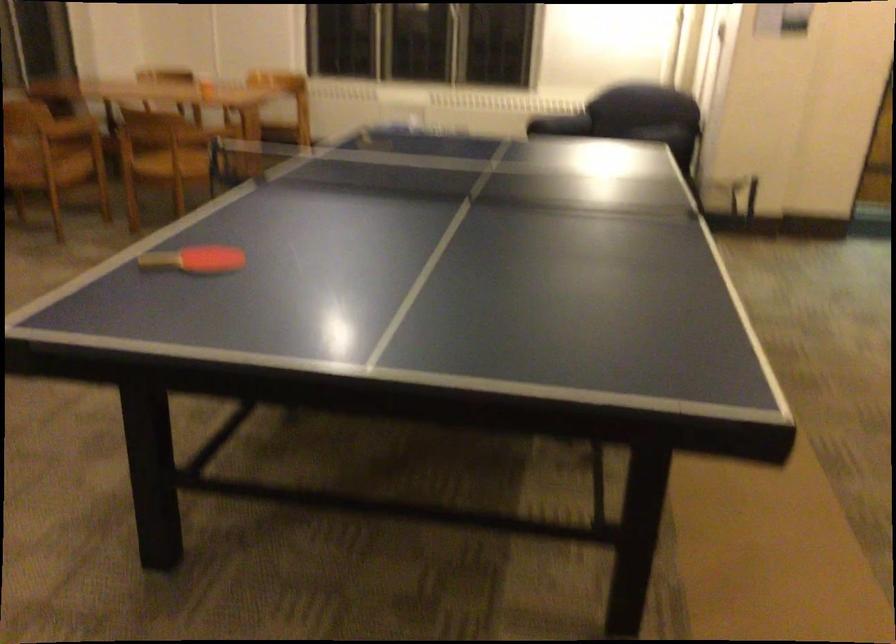
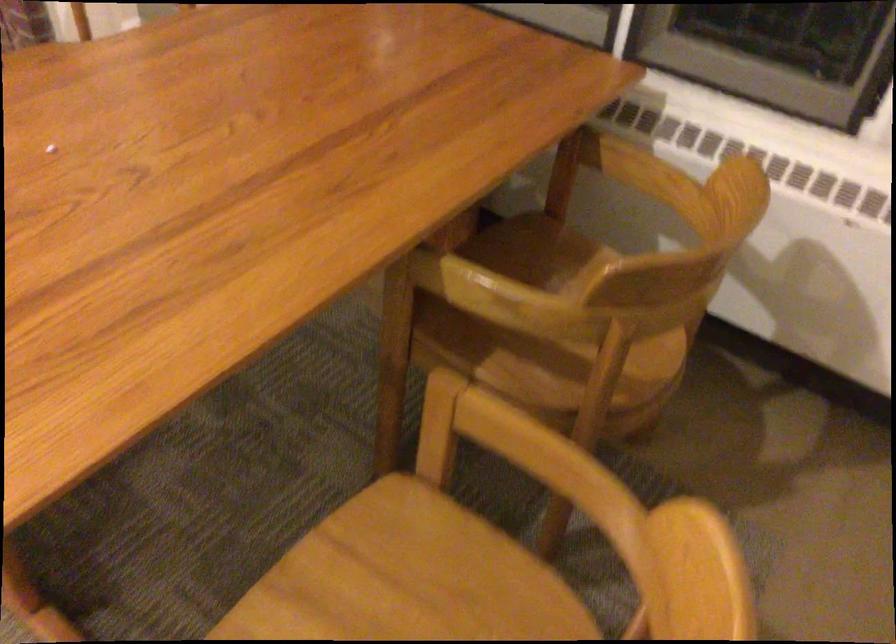
Locate, in the second image, the point that corresponds to pixel 268 120 in the first image.

(407, 579)